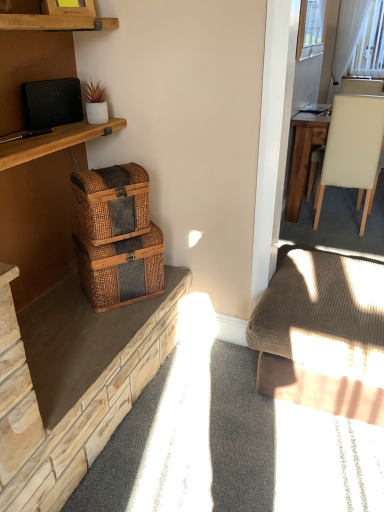
Question: Considering the positions of woven wood baskets at left and white sheer curtain at upper right in the image, is woven wood baskets at left wider or thinner than white sheer curtain at upper right?

Choices:
 (A) wide
 (B) thin

Answer: (A)

Question: Which is correct: woven wood baskets at left is inside white sheer curtain at upper right, or outside of it?

Choices:
 (A) inside
 (B) outside

Answer: (B)

Question: Which object is positioned farthest from the black matte speaker at upper left?

Choices:
 (A) woven brown picnic basket at lower left, placed as the first picnic basket when sorted from bottom to top
 (B) white sheer curtain at upper right
 (C) ribbed brown fabric couch at lower right
 (D) woven brown picnic basket at left, which appears as the second picnic basket when ordered from the bottom
 (E) white matte pot at upper left

Answer: (B)

Question: Estimate the real-world distances between objects in this image. Which object is farther from the black matte speaker at upper left?

Choices:
 (A) woven brown picnic basket at lower left, placed as the first picnic basket when sorted from bottom to top
 (B) white matte pot at upper left
 (C) beige leather chair at right
 (D) ribbed brown fabric couch at lower right
 (E) woven wood baskets at left

Answer: (C)